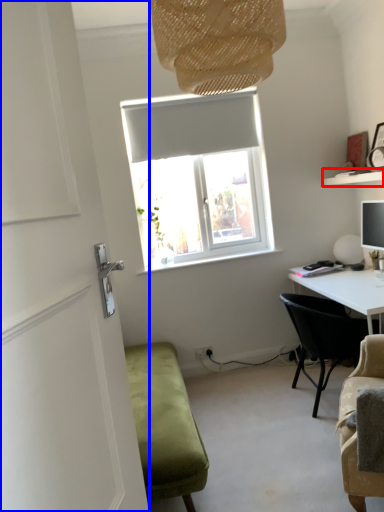
Question: Which object appears farthest to the camera in this image, shelf (highlighted by a red box) or door (highlighted by a blue box)?

Choices:
 (A) shelf
 (B) door

Answer: (A)